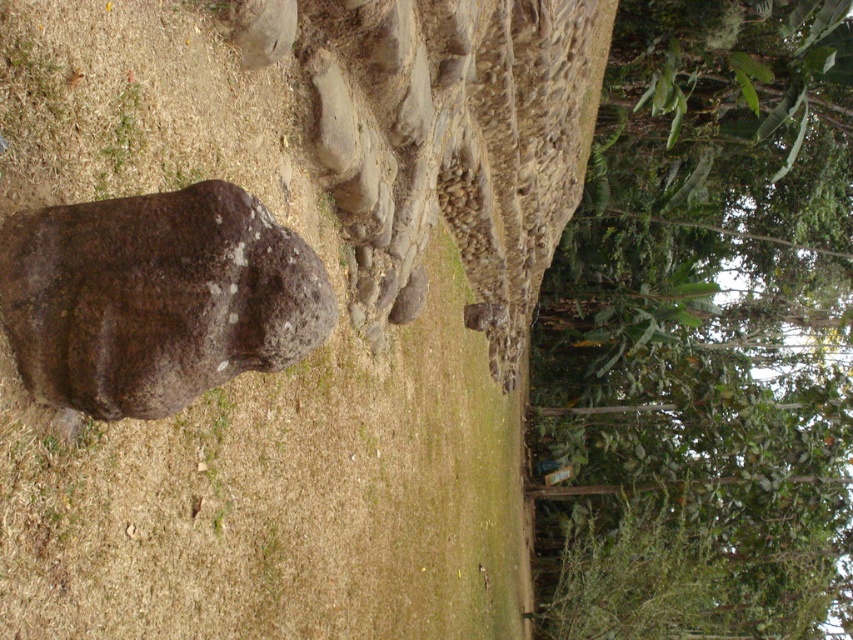
You are standing in the outdoor scene and want to take a photo of the brown rough stone at center. To avoid the green leafy tree at upper right blocking the view, which direction should you move to get a clear shot?

Move to the left side of the brown rough stone at center to avoid the green leafy tree at upper right blocking the view, since the tree is on the right side of the stone.

You are a gardener planning to plant a new tree in the area near the brown rough stone at center. Considering the size of the green leafy tree at upper right, which object would require more space in the garden?

The green leafy tree at upper right requires more space in the garden because it has a larger size compared to the brown rough stone at center.

Looking at this image, you are standing at the center of the image and want to locate the green leafy tree at upper right. Which direction should you look to find it?

You should look to the upper right direction to find the green leafy tree at upper right, as it is located at point (x=703, y=333).